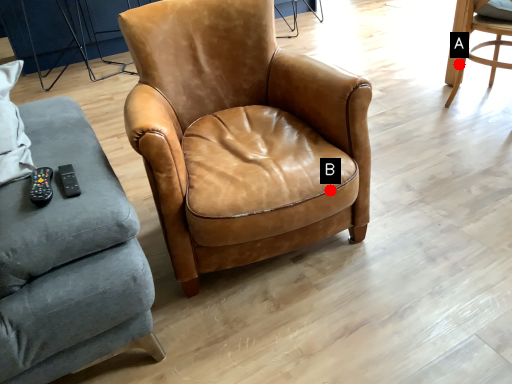
Question: Two points are circled on the image, labeled by A and B beside each circle. Which of the following is the closest to the observer?

Choices:
 (A) A is closer
 (B) B is closer

Answer: (B)